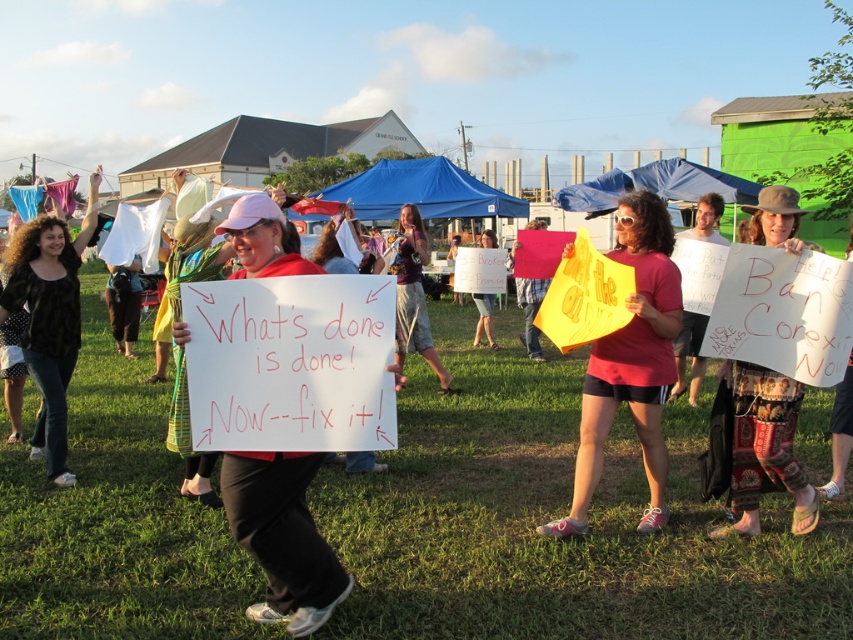
Question: Which of the following is the closest to the observer?

Choices:
 (A) (408, 288)
 (B) (82, 241)
 (C) (247, 464)

Answer: (C)

Question: Which object is farther from the camera taking this photo?

Choices:
 (A) maroon fabric shirt at center
 (B) matte yellow sign at center
 (C) printed fabric sign at center
 (D) black leopard print shirt at left

Answer: (A)

Question: Is black leopard print shirt at left wider than maroon fabric shirt at center?

Choices:
 (A) no
 (B) yes

Answer: (A)

Question: Can you confirm if printed fabric sign at center is positioned above maroon fabric shirt at center?

Choices:
 (A) yes
 (B) no

Answer: (B)

Question: Does green grass at center have a greater width compared to printed fabric sign at center?

Choices:
 (A) no
 (B) yes

Answer: (B)

Question: Estimate the real-world distances between objects in this image. Which object is closer to the black leopard print shirt at left?

Choices:
 (A) printed fabric sign at center
 (B) maroon fabric shirt at center

Answer: (B)